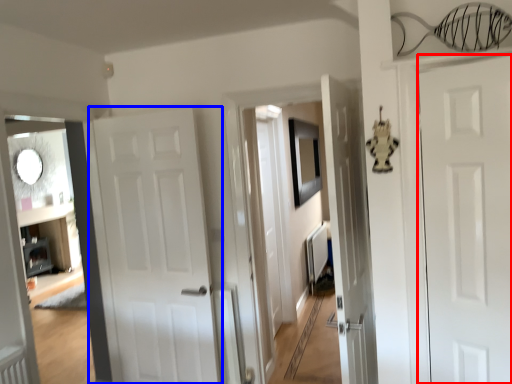
Question: Among these objects, which one is farthest to the camera, door (highlighted by a red box) or door (highlighted by a blue box)?

Choices:
 (A) door
 (B) door

Answer: (B)